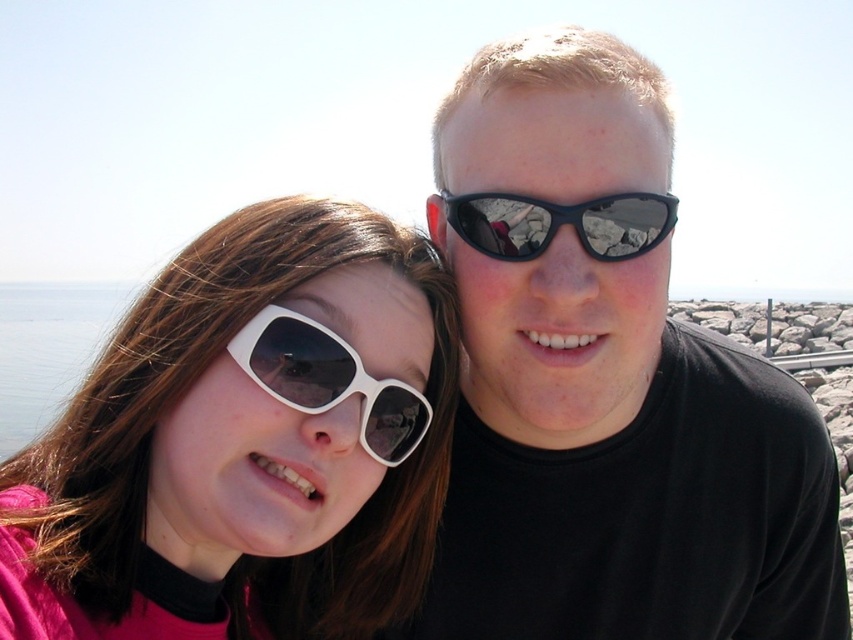
Question: Which point is farther to the camera?

Choices:
 (A) (512, 42)
 (B) (297, 408)
 (C) (497, 208)

Answer: (A)

Question: Which of the following is the farthest from the observer?

Choices:
 (A) (438, 300)
 (B) (492, 76)

Answer: (B)

Question: Where is matte black sunglasses at upper right located in relation to black reflective sunglasses at upper center in the image?

Choices:
 (A) below
 (B) above

Answer: (A)

Question: Does white matte sunglasses at center have a smaller size compared to black reflective sunglasses at upper center?

Choices:
 (A) no
 (B) yes

Answer: (A)

Question: Can you confirm if white matte sunglasses at left is positioned above white matte sunglasses at center?

Choices:
 (A) yes
 (B) no

Answer: (B)

Question: Which point is closer to the camera?

Choices:
 (A) (614, 209)
 (B) (94, 586)
 (C) (247, 355)

Answer: (B)